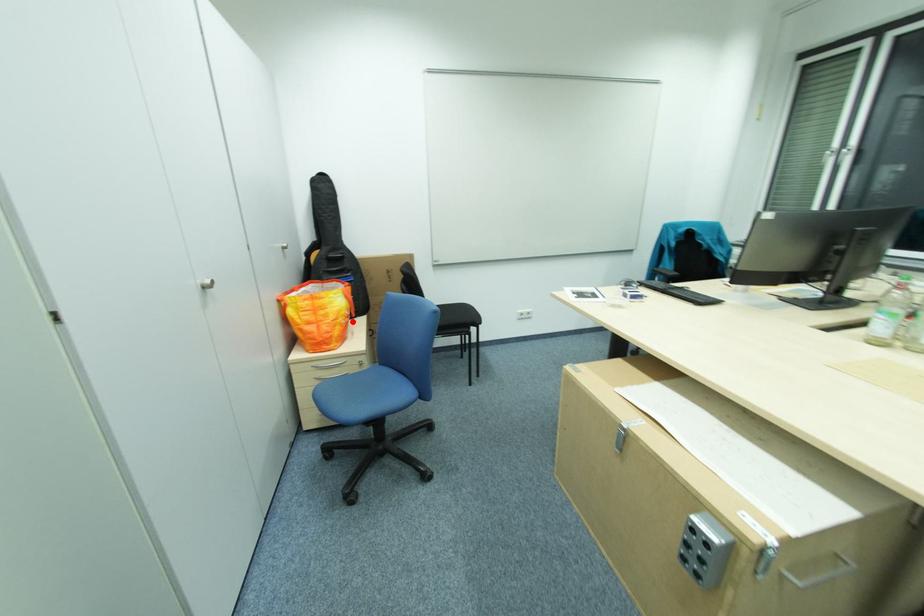
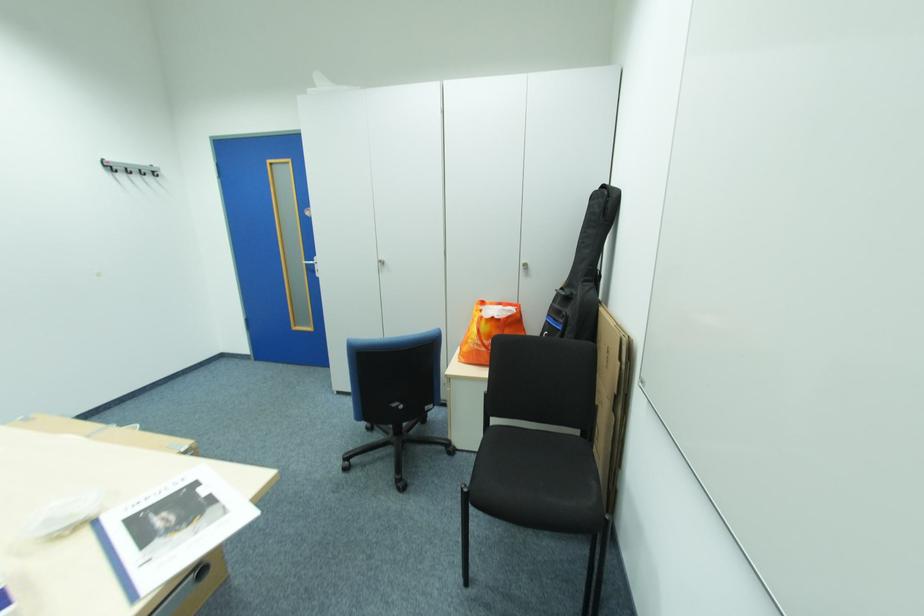
Question: I am providing you with two images of the same scene from different viewpoints. Given a red point in image1, look at the same physical point in image2. Is it:

Choices:
 (A) Closer to the viewpoint
 (B) Farther from the viewpoint

Answer: (B)